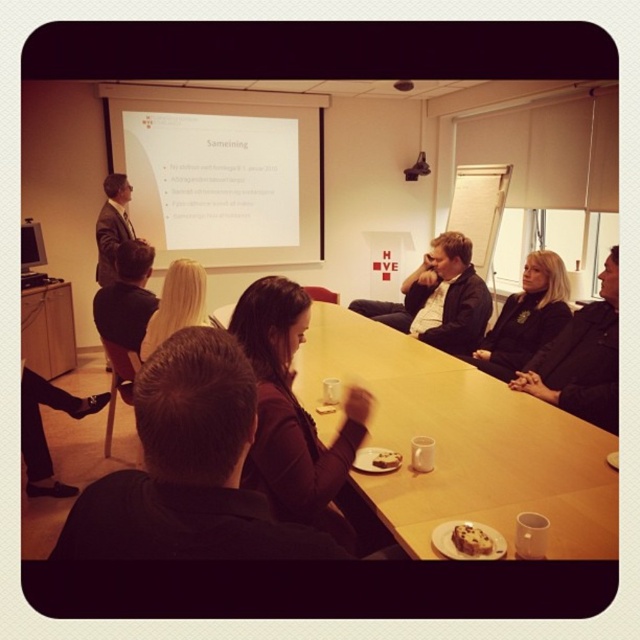
Can you confirm if matte brown jacket at center is positioned above matte wood table at lower left?

No, matte brown jacket at center is not above matte wood table at lower left.

Can you confirm if matte brown jacket at center is thinner than matte wood table at lower left?

No.

Between point (292, 314) and point (51, 321), which one is positioned in front?

Point (292, 314) is more forward.

At what (x,y) coordinates should I click in order to perform the action: click on matte brown jacket at center. Please return your answer as a coordinate pair (x, y). Looking at the image, I should click on (292, 413).

Does matte wood table at lower left appear on the right side of blonde hair at center?

In fact, matte wood table at lower left is to the left of blonde hair at center.

Can you confirm if matte wood table at lower left is shorter than blonde hair at center?

No, matte wood table at lower left is not shorter than blonde hair at center.

Who is more forward, (33, 314) or (198, 323)?

Point (198, 323)

This screenshot has height=640, width=640. I want to click on matte wood table at lower left, so click(48, 330).

How far apart are wooden table at center and matte brown jacket at center?

wooden table at center and matte brown jacket at center are 16.40 inches apart from each other.

Is point (496, 472) positioned in front of point (349, 451)?

No, it is not.

Does point (490, 381) come closer to viewer compared to point (344, 474)?

No, it is not.

I want to click on wooden table at center, so click(x=461, y=442).